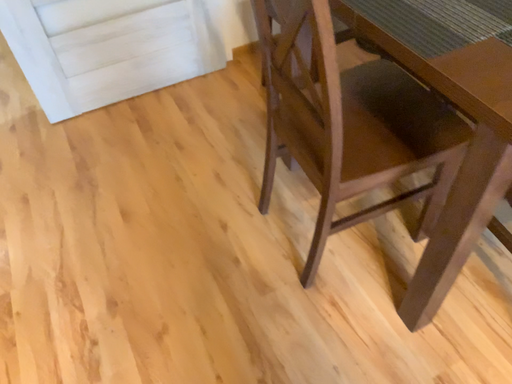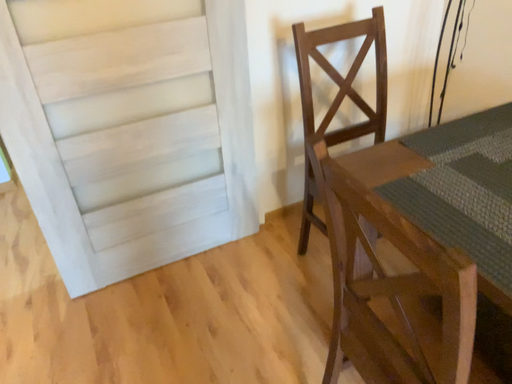
Question: How did the camera likely rotate when shooting the video?

Choices:
 (A) rotated upward
 (B) rotated downward

Answer: (A)